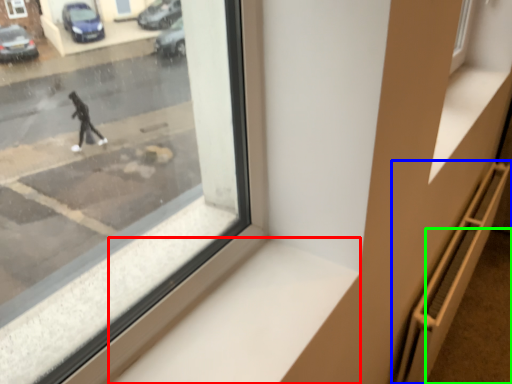
Question: Based on their relative distances, which object is nearer to window sill (highlighted by a red box)? Choose from stairwell (highlighted by a blue box) and pavement (highlighted by a green box).

Choices:
 (A) stairwell
 (B) pavement

Answer: (A)